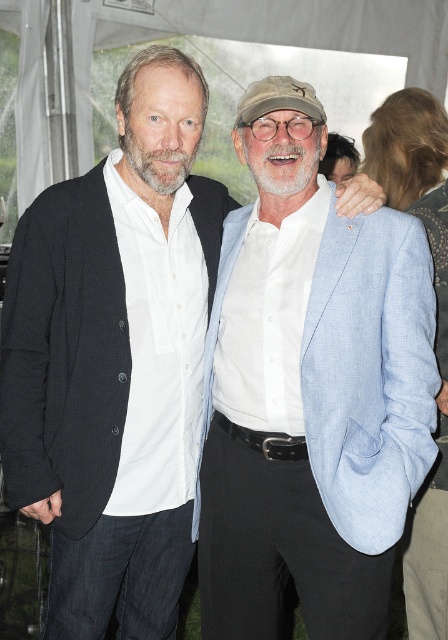
Question: Can you confirm if light blue linen blazer at center is smaller than white fabric canopy at upper center?

Choices:
 (A) no
 (B) yes

Answer: (B)

Question: Can you confirm if light blue linen blazer at center is positioned below white fabric canopy at upper center?

Choices:
 (A) yes
 (B) no

Answer: (A)

Question: Which of the following is the farthest from the observer?

Choices:
 (A) (347, 477)
 (B) (42, 13)

Answer: (B)

Question: Which point is farther to the camera?

Choices:
 (A) white fabric canopy at upper center
 (B) light blue linen blazer at center

Answer: (A)

Question: From the image, what is the correct spatial relationship of light blue linen blazer at center in relation to white fabric canopy at upper center?

Choices:
 (A) below
 (B) above

Answer: (A)